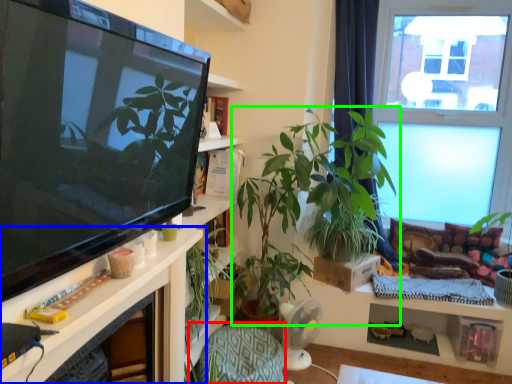
Question: Which object is positioned closest to armchair (highlighted by a red box)? Select from shelf (highlighted by a blue box) and houseplant (highlighted by a green box).

Choices:
 (A) shelf
 (B) houseplant

Answer: (A)